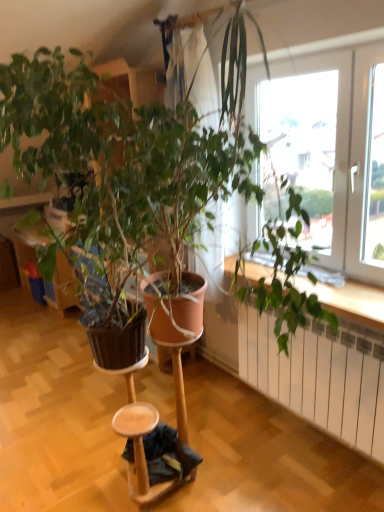
Question: Considering the positions of white metallic radiator at lower right and wooden step stool at lower center in the image, is white metallic radiator at lower right bigger or smaller than wooden step stool at lower center?

Choices:
 (A) big
 (B) small

Answer: (A)

Question: Considering the positions of white metallic radiator at lower right and wooden step stool at lower center in the image, is white metallic radiator at lower right wider or thinner than wooden step stool at lower center?

Choices:
 (A) thin
 (B) wide

Answer: (A)

Question: Relative to wooden step stool at lower center, is white metallic radiator at lower right in front or behind?

Choices:
 (A) front
 (B) behind

Answer: (A)

Question: Considering the positions of point (122, 429) and point (360, 449), is point (122, 429) closer or farther from the camera than point (360, 449)?

Choices:
 (A) farther
 (B) closer

Answer: (B)

Question: Considering the relative positions of wooden step stool at lower center and white metallic radiator at lower right in the image provided, is wooden step stool at lower center to the left or to the right of white metallic radiator at lower right?

Choices:
 (A) right
 (B) left

Answer: (B)

Question: From a real-world perspective, is wooden step stool at lower center physically located above or below white metallic radiator at lower right?

Choices:
 (A) above
 (B) below

Answer: (B)

Question: In terms of height, does wooden step stool at lower center look taller or shorter compared to white metallic radiator at lower right?

Choices:
 (A) tall
 (B) short

Answer: (B)